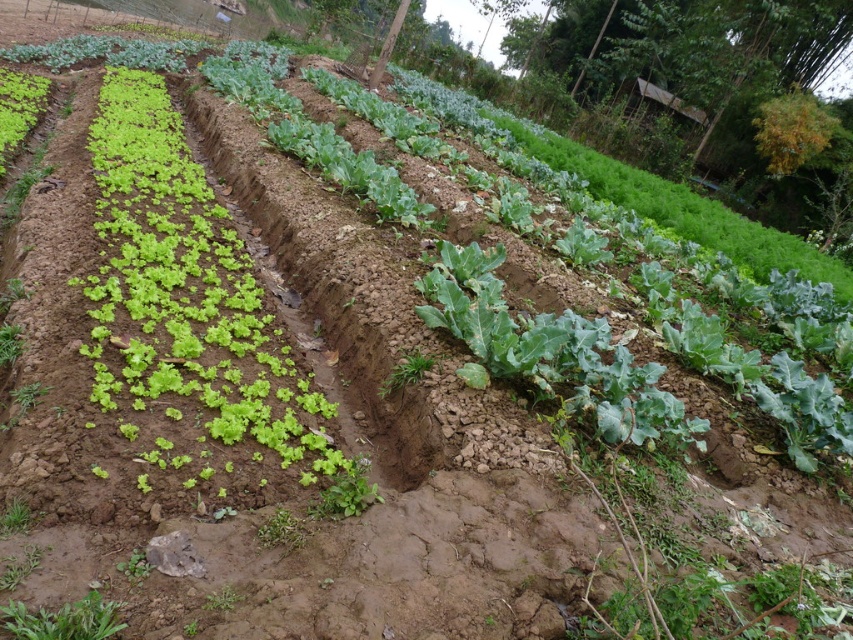
Can you confirm if green leafy at lower left is positioned below green leafy at center?

No.

This screenshot has width=853, height=640. Describe the element at coordinates (62, 620) in the screenshot. I see `green leafy at lower left` at that location.

Does point (65, 604) come in front of point (212, 605)?

That is True.

Identify the location of green leafy at lower left. (62, 620).

Who is more forward, (148,342) or (233,588)?

Point (233,588) is more forward.

Can you confirm if green leafy lettuce at left is shorter than green leafy at center?

No, green leafy lettuce at left is not shorter than green leafy at center.

Between point (119, 163) and point (221, 602), which one is positioned in front?

Point (221, 602) is in front.

Locate an element on the screen. The height and width of the screenshot is (640, 853). green leafy lettuce at left is located at coordinates (196, 291).

Is green leafy lettuce at left positioned before green leafy at lower left?

No, it is behind green leafy at lower left.

Does green leafy lettuce at left have a greater width compared to green leafy at lower left?

Yes, green leafy lettuce at left is wider than green leafy at lower left.

Is point (171, 284) less distant than point (84, 636)?

That is False.

This screenshot has height=640, width=853. Identify the location of green leafy lettuce at left. (196, 291).